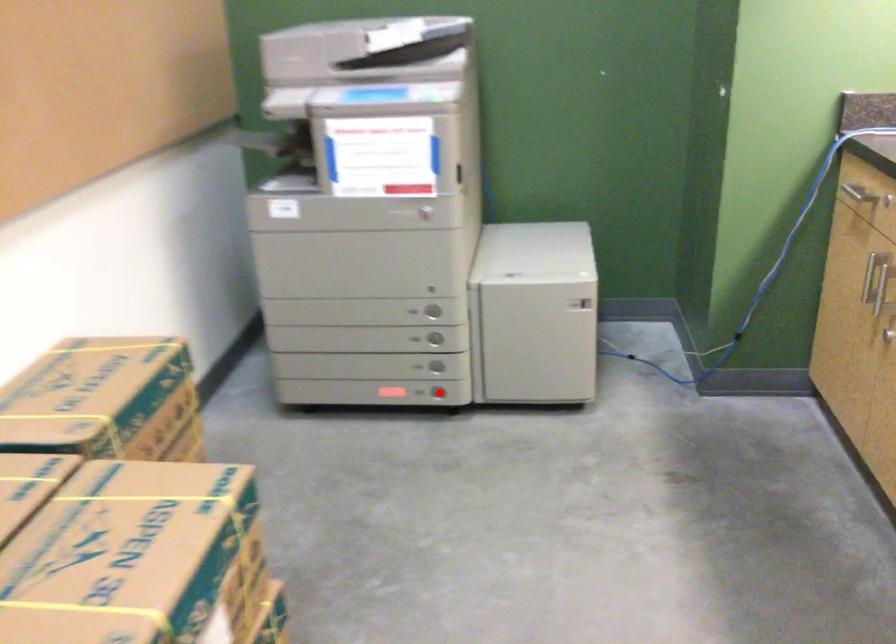
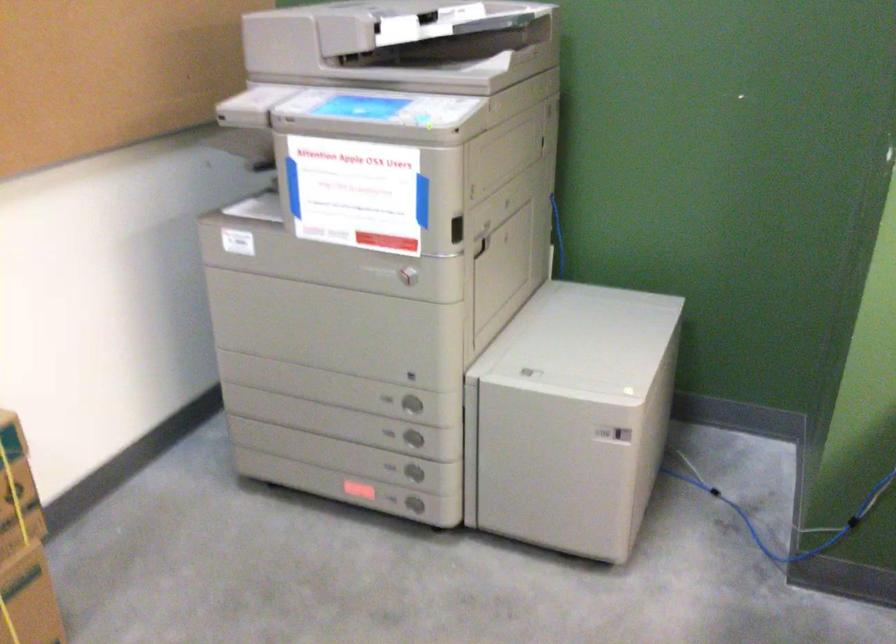
The point at the highlighted location is marked in the first image. Where is the corresponding point in the second image?

(414, 505)